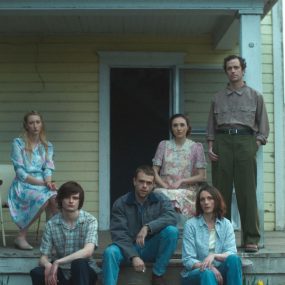
The height and width of the screenshot is (285, 285). I want to click on chair, so click(x=6, y=176), click(x=180, y=228).